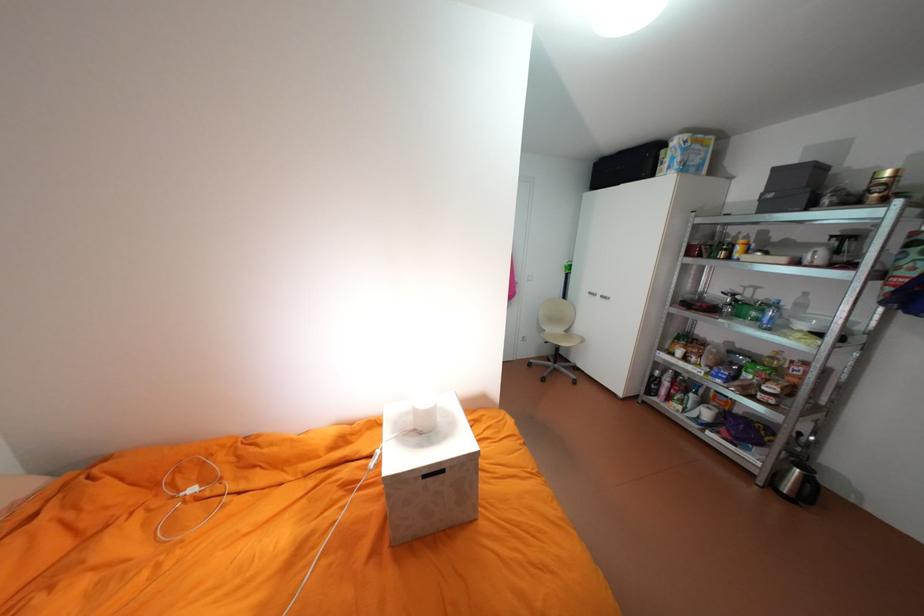
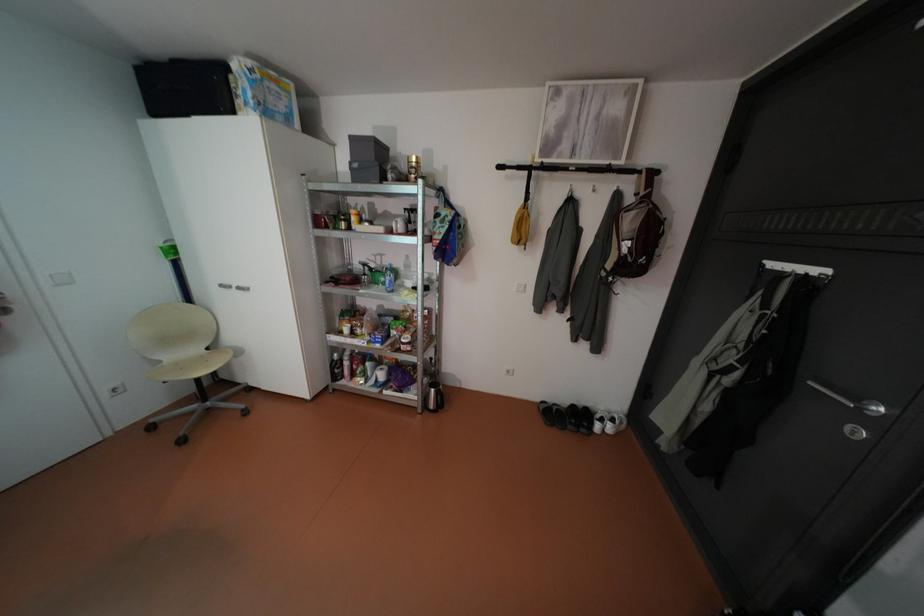
Find the pixel in the second image that matches (x=553, y=330) in the first image.

(168, 361)